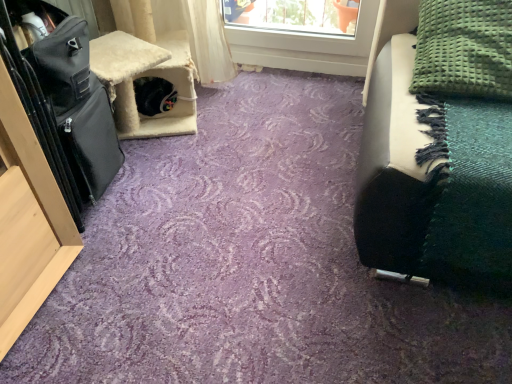
Locate an element on the screen. The width and height of the screenshot is (512, 384). black leather suitcase at left is located at coordinates (78, 106).

What do you see at coordinates (78, 106) in the screenshot? I see `black leather suitcase at left` at bounding box center [78, 106].

Image resolution: width=512 pixels, height=384 pixels. Identify the location of green textured blanket at upper right. (464, 49).

This screenshot has width=512, height=384. What do you see at coordinates (464, 49) in the screenshot? I see `green textured blanket at upper right` at bounding box center [464, 49].

In order to click on black leather suitcase at left in this screenshot , I will do `click(78, 106)`.

Can you confirm if black leather suitcase at left is positioned to the left of green textured blanket at upper right?

Indeed, black leather suitcase at left is positioned on the left side of green textured blanket at upper right.

In the image, is black leather suitcase at left positioned in front of or behind green textured blanket at upper right?

black leather suitcase at left is in front of green textured blanket at upper right.

Considering the positions of point (47, 76) and point (510, 36), is point (47, 76) closer or farther from the camera than point (510, 36)?

Point (47, 76).

From the image's perspective, is black leather suitcase at left beneath green textured blanket at upper right?

Yes, from the image's perspective, black leather suitcase at left is beneath green textured blanket at upper right.

From a real-world perspective, does black leather suitcase at left sit lower than green textured blanket at upper right?

Yes, from a real-world perspective, black leather suitcase at left is beneath green textured blanket at upper right.

In terms of width, does black leather suitcase at left look wider or thinner when compared to green textured blanket at upper right?

black leather suitcase at left is wider than green textured blanket at upper right.

Can you confirm if black leather suitcase at left is shorter than green textured blanket at upper right?

In fact, black leather suitcase at left may be taller than green textured blanket at upper right.

Considering the sizes of black leather suitcase at left and green textured blanket at upper right in the image, is black leather suitcase at left bigger or smaller than green textured blanket at upper right?

Clearly, black leather suitcase at left is larger in size than green textured blanket at upper right.

Is green textured blanket at upper right completely or partially inside black leather suitcase at left?

No, green textured blanket at upper right is not surrounded by black leather suitcase at left.

Is black leather suitcase at left not near green textured blanket at upper right?

No, black leather suitcase at left is not far from green textured blanket at upper right.

Is black leather suitcase at left facing away from green textured blanket at upper right?

black leather suitcase at left does not have its back to green textured blanket at upper right.

Identify the location of blanket lying on the right of black leather suitcase at left. The image size is (512, 384). coord(464,49).

Based on the photo, can you confirm if green textured blanket at upper right is positioned to the right of black leather suitcase at left?

Correct, you'll find green textured blanket at upper right to the right of black leather suitcase at left.

In the scene shown: Which is in front, green textured blanket at upper right or black leather suitcase at left?

black leather suitcase at left is in front.

Which is in front, point (476, 62) or point (115, 147)?

Point (476, 62)

From the image's perspective, is green textured blanket at upper right on top of black leather suitcase at left?

Yes, from the image's perspective, green textured blanket at upper right is over black leather suitcase at left.

Based on the photo, from a real-world perspective, who is located higher, green textured blanket at upper right or black leather suitcase at left?

green textured blanket at upper right is physically above.

Which of these two, green textured blanket at upper right or black leather suitcase at left, is wider?

With larger width is black leather suitcase at left.

Is green textured blanket at upper right shorter than black leather suitcase at left?

Indeed, green textured blanket at upper right has a lesser height compared to black leather suitcase at left.

From the picture: Can you confirm if green textured blanket at upper right is smaller than black leather suitcase at left?

Yes.

Based on the photo, is green textured blanket at upper right spatially inside black leather suitcase at left, or outside of it?

green textured blanket at upper right is located beyond the bounds of black leather suitcase at left.

Is green textured blanket at upper right positioned far away from black leather suitcase at left?

That's not correct — green textured blanket at upper right is a little close to black leather suitcase at left.

Is green textured blanket at upper right facing away from black leather suitcase at left?

No, green textured blanket at upper right's orientation is not away from black leather suitcase at left.

How far apart are green textured blanket at upper right and black leather suitcase at left?

38.96 inches.

Identify the location of blanket located above the black leather suitcase at left (from the image's perspective). (464, 49).

The image size is (512, 384). I want to click on blanket located above the black leather suitcase at left (from the image's perspective), so click(x=464, y=49).

Image resolution: width=512 pixels, height=384 pixels. What are the coordinates of `luggage below the green textured blanket at upper right (from the image's perspective)` in the screenshot? It's located at (78, 106).